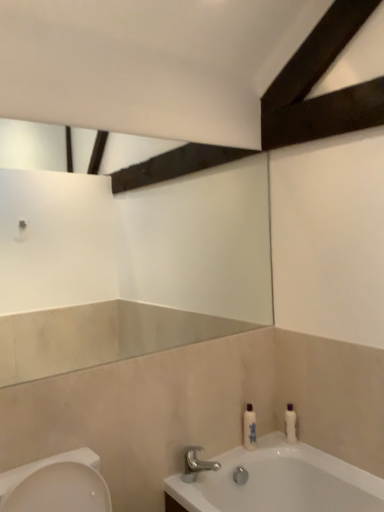
Question: Are polished chrome faucet at lower center and white glossy bottle at lower right, positioned as the 2th toiletry in right-to-left order, located far from each other?

Choices:
 (A) yes
 (B) no

Answer: (B)

Question: From a real-world perspective, is polished chrome faucet at lower center over white glossy bottle at lower right, the first toiletry viewed from the left?

Choices:
 (A) no
 (B) yes

Answer: (A)

Question: Considering the relative positions of polished chrome faucet at lower center and white glossy bottle at lower right, positioned as the 2th toiletry in right-to-left order, in the image provided, is polished chrome faucet at lower center behind white glossy bottle at lower right, positioned as the 2th toiletry in right-to-left order,?

Choices:
 (A) yes
 (B) no

Answer: (B)

Question: Can you confirm if polished chrome faucet at lower center is thinner than white glossy bottle at lower right, the first toiletry viewed from the left?

Choices:
 (A) no
 (B) yes

Answer: (A)

Question: Considering the relative sizes of polished chrome faucet at lower center and white glossy bottle at lower right, the first toiletry viewed from the left, in the image provided, is polished chrome faucet at lower center wider than white glossy bottle at lower right, the first toiletry viewed from the left,?

Choices:
 (A) no
 (B) yes

Answer: (B)

Question: Is the surface of polished chrome faucet at lower center in direct contact with white glossy bottle at lower right, the first toiletry viewed from the left?

Choices:
 (A) yes
 (B) no

Answer: (B)

Question: From the image's perspective, is white glossy bottle at right, arranged as the 2th toiletry when viewed from the left, under white glossy bottle at lower right, positioned as the 2th toiletry in right-to-left order?

Choices:
 (A) yes
 (B) no

Answer: (A)

Question: Can we say white glossy bottle at right, arranged as the 2th toiletry when viewed from the left, lies outside white glossy bottle at lower right, positioned as the 2th toiletry in right-to-left order?

Choices:
 (A) yes
 (B) no

Answer: (A)

Question: Can you confirm if white glossy bottle at right, acting as the first toiletry starting from the right, is taller than white glossy bottle at lower right, positioned as the 2th toiletry in right-to-left order?

Choices:
 (A) no
 (B) yes

Answer: (A)

Question: Considering the relative positions of white glossy bottle at right, acting as the first toiletry starting from the right, and white glossy bottle at lower right, positioned as the 2th toiletry in right-to-left order, in the image provided, is white glossy bottle at right, acting as the first toiletry starting from the right, to the left of white glossy bottle at lower right, positioned as the 2th toiletry in right-to-left order, from the viewer's perspective?

Choices:
 (A) no
 (B) yes

Answer: (A)

Question: Is white glossy bottle at right, arranged as the 2th toiletry when viewed from the left, behind white glossy bottle at lower right, positioned as the 2th toiletry in right-to-left order?

Choices:
 (A) yes
 (B) no

Answer: (A)

Question: Is white glossy bottle at right, acting as the first toiletry starting from the right, aimed at white glossy bottle at lower right, positioned as the 2th toiletry in right-to-left order?

Choices:
 (A) yes
 (B) no

Answer: (B)

Question: Considering the relative positions of polished chrome faucet at lower center and white glossy bottle at right, acting as the first toiletry starting from the right, in the image provided, is polished chrome faucet at lower center in front of white glossy bottle at right, acting as the first toiletry starting from the right,?

Choices:
 (A) no
 (B) yes

Answer: (B)